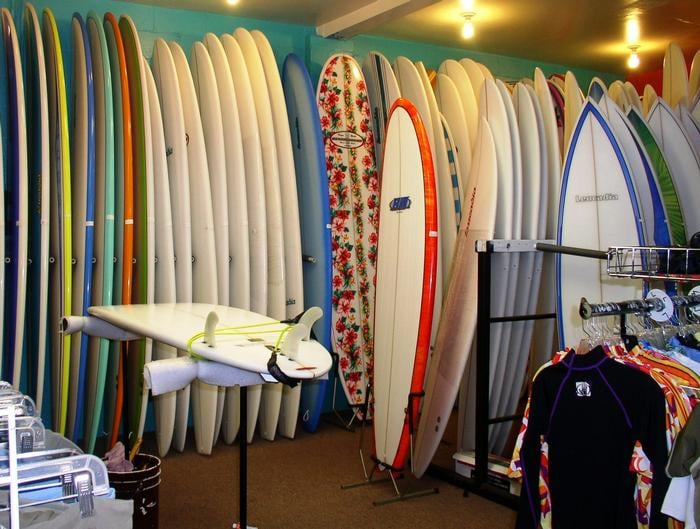
Identify the location of clothing rack. (17, 481), (634, 300).